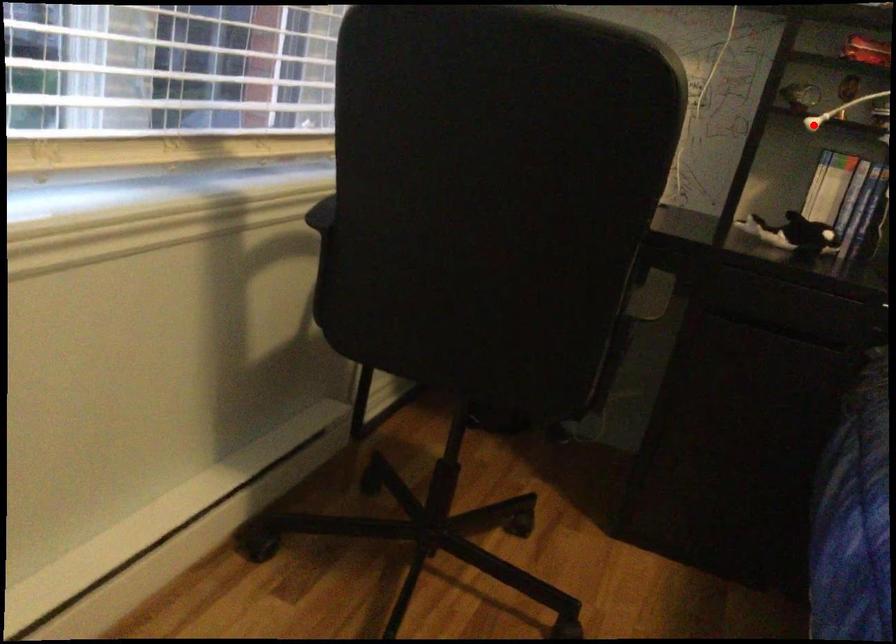
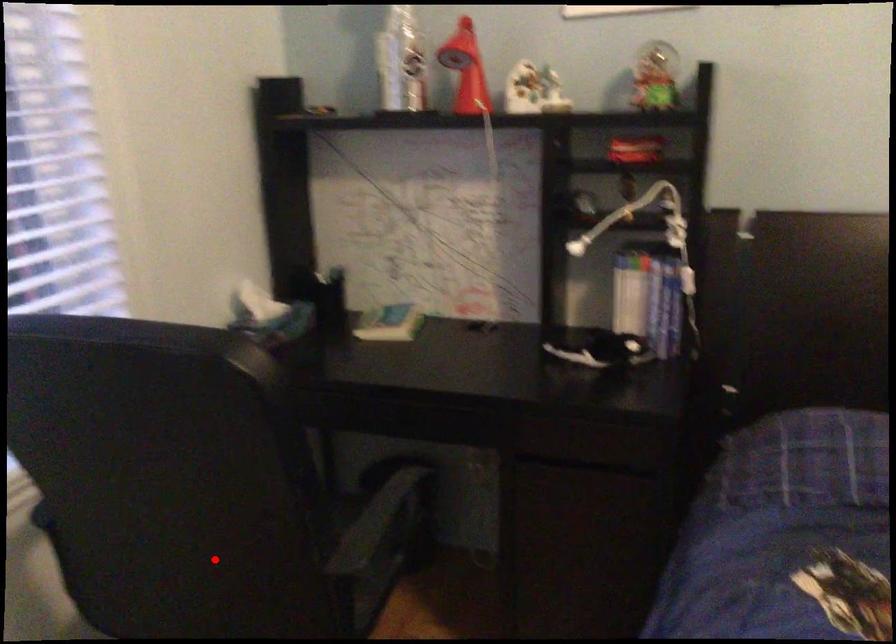
I am providing you with two images of the same scene from different viewpoints. A red point is marked on the first image and another point is marked on the second image. Are the points marked in image1 and image2 representing the same 3D position?

No